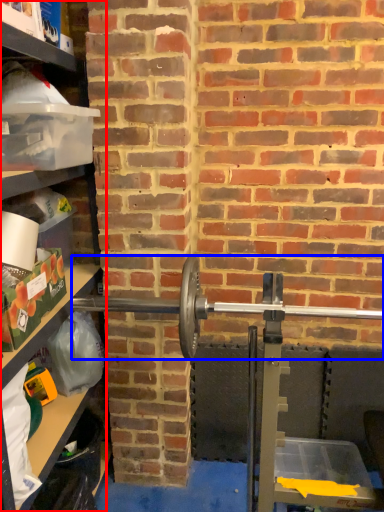
Question: Which object appears closest to the camera in this image, shelf (highlighted by a red box) or barbell (highlighted by a blue box)?

Choices:
 (A) shelf
 (B) barbell

Answer: (A)